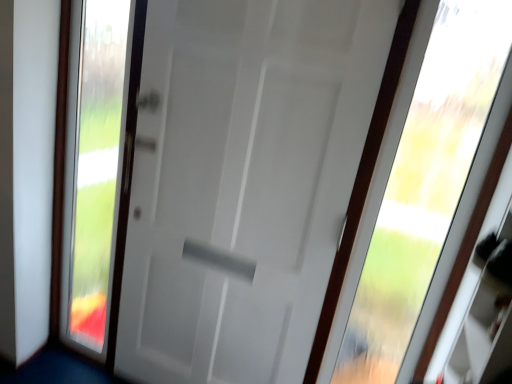
Question: Considering the relative sizes of transparent glass window at upper right and transparent glass door at left in the image provided, is transparent glass window at upper right wider than transparent glass door at left?

Choices:
 (A) yes
 (B) no

Answer: (A)

Question: Is transparent glass door at left at the back of transparent glass window at upper right?

Choices:
 (A) yes
 (B) no

Answer: (B)

Question: From a real-world perspective, is transparent glass window at upper right physically above transparent glass door at left?

Choices:
 (A) no
 (B) yes

Answer: (B)

Question: Considering the relative positions of transparent glass window at upper right and transparent glass door at left in the image provided, is transparent glass window at upper right to the right of transparent glass door at left from the viewer's perspective?

Choices:
 (A) yes
 (B) no

Answer: (A)

Question: Is transparent glass window at upper right not near transparent glass door at left?

Choices:
 (A) yes
 (B) no

Answer: (A)

Question: Is transparent glass door at left inside or outside of white matte door at center?

Choices:
 (A) outside
 (B) inside

Answer: (A)

Question: Considering the positions of point (98, 180) and point (220, 319), is point (98, 180) closer or farther from the camera than point (220, 319)?

Choices:
 (A) closer
 (B) farther

Answer: (B)

Question: Is transparent glass door at left wider or thinner than white matte door at center?

Choices:
 (A) wide
 (B) thin

Answer: (B)

Question: Is transparent glass door at left to the left or to the right of white matte door at center in the image?

Choices:
 (A) right
 (B) left

Answer: (B)

Question: Is white matte door at center in front of or behind transparent glass door at left in the image?

Choices:
 (A) behind
 (B) front

Answer: (B)

Question: Considering the positions of point (265, 77) and point (74, 319), is point (265, 77) closer or farther from the camera than point (74, 319)?

Choices:
 (A) farther
 (B) closer

Answer: (B)

Question: Considering the relative positions of white matte door at center and transparent glass door at left in the image provided, is white matte door at center to the left or to the right of transparent glass door at left?

Choices:
 (A) right
 (B) left

Answer: (A)

Question: Is white matte door at center spatially inside transparent glass door at left, or outside of it?

Choices:
 (A) outside
 (B) inside

Answer: (A)

Question: Considering the positions of point (101, 326) and point (395, 350), is point (101, 326) closer or farther from the camera than point (395, 350)?

Choices:
 (A) farther
 (B) closer

Answer: (B)

Question: In the image, is transparent glass door at left positioned in front of or behind transparent glass window at upper right?

Choices:
 (A) behind
 (B) front

Answer: (A)